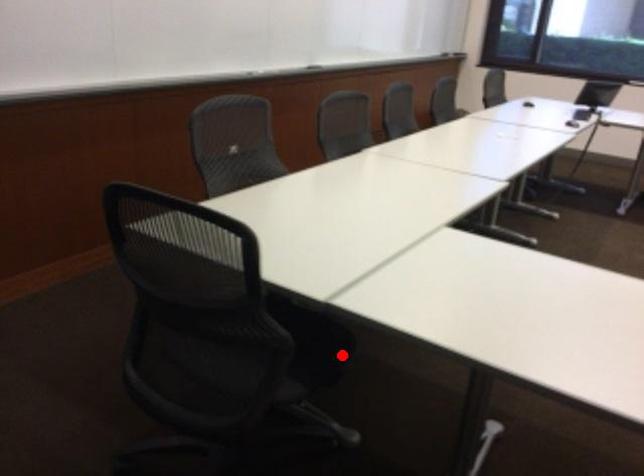
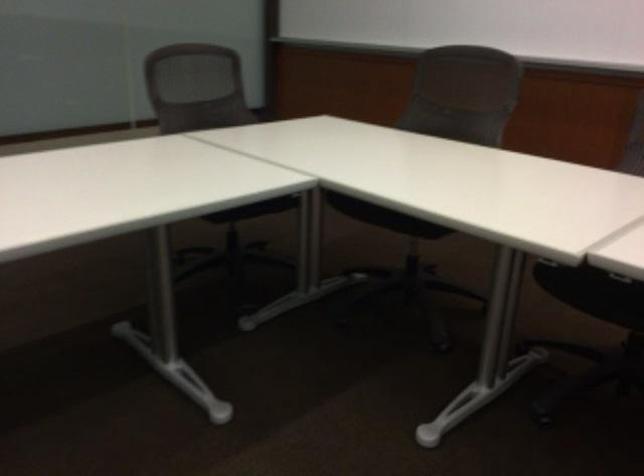
Question: A red point is marked in image1. In image2, is the corresponding 3D point closer to the camera or farther? Reply with the corresponding letter.

Choices:
 (A) The corresponding 3D point is closer.
 (B) The corresponding 3D point is farther.

Answer: (B)